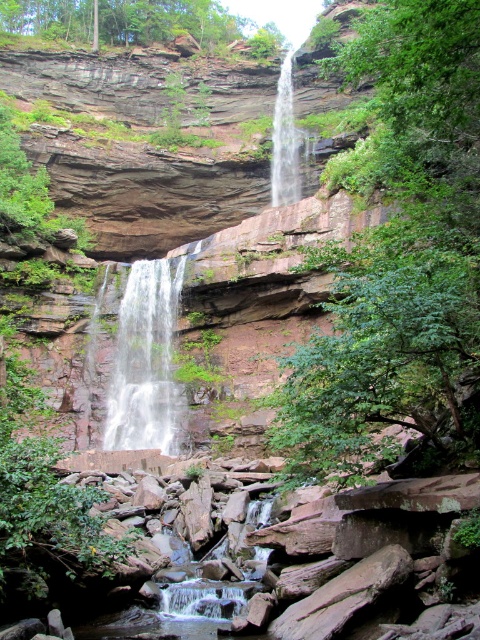
Question: Among these objects, which one is nearest to the camera?

Choices:
 (A) smooth rock creek at lower center
 (B) green leafy tree at center

Answer: (A)

Question: In this image, where is green leafy tree at center located relative to green leafy tree at upper center?

Choices:
 (A) left
 (B) right

Answer: (B)

Question: Does green leafy tree at center lie in front of white frothy water at center?

Choices:
 (A) no
 (B) yes

Answer: (B)

Question: Among these objects, which one is nearest to the camera?

Choices:
 (A) smooth rock creek at lower center
 (B) green leafy tree at center
 (C) white smooth waterfall at center

Answer: (A)

Question: Can you confirm if green leafy tree at center is positioned to the right of green leafy tree at upper center?

Choices:
 (A) no
 (B) yes

Answer: (B)

Question: Which of these objects is positioned closest to the smooth rock creek at lower center?

Choices:
 (A) green leafy tree at upper center
 (B) green leafy tree at center
 (C) white frothy water at center

Answer: (B)